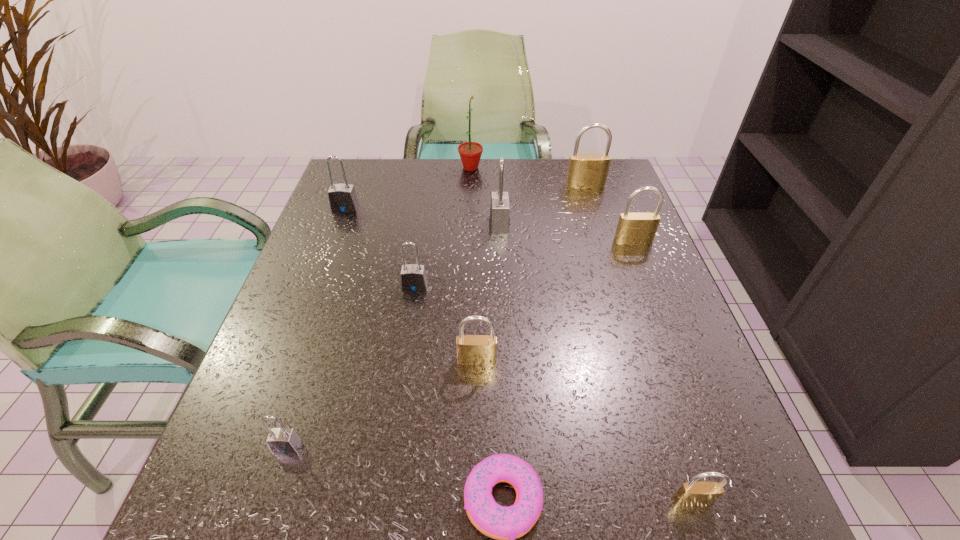
Locate an element on the screen. This screenshot has height=540, width=960. vacant space located on the shackle of the sixth nearest padlock is located at coordinates (420, 224).

You are a GUI agent. You are given a task and a screenshot of the screen. Output one action in this format:
    pyautogui.click(x=<x>, y=<y>)
    Task: Click on the vacant space located on the shackle of the sixth nearest padlock
    
    Given the screenshot: What is the action you would take?
    pyautogui.click(x=424, y=224)

The height and width of the screenshot is (540, 960). I want to click on vacant space situated 0.220m on the shackle of the sixth nearest padlock, so coord(400,224).

The image size is (960, 540). Find the location of `vacant space located on the shackle of the eighth nearest object`. vacant space located on the shackle of the eighth nearest object is located at coordinates (307, 310).

Find the location of `vacant point located 0.270m on the front-facing side of the fifth farthest object`. vacant point located 0.270m on the front-facing side of the fifth farthest object is located at coordinates (670, 336).

The height and width of the screenshot is (540, 960). I want to click on vacant space located 0.240m on the shackle of the second smallest gray padlock, so click(x=398, y=393).

This screenshot has width=960, height=540. In order to click on vacant space located 0.260m on the front-facing side of the fourth nearest object in this screenshot , I will do `click(476, 525)`.

The image size is (960, 540). I want to click on vacant space located 0.050m on the shackle of the third nearest object, so click(273, 488).

Where is `sunflower situated at the far edge`? The height and width of the screenshot is (540, 960). sunflower situated at the far edge is located at coordinates (470, 153).

Where is `object that is at the near edge`? The height and width of the screenshot is (540, 960). object that is at the near edge is located at coordinates (692, 493).